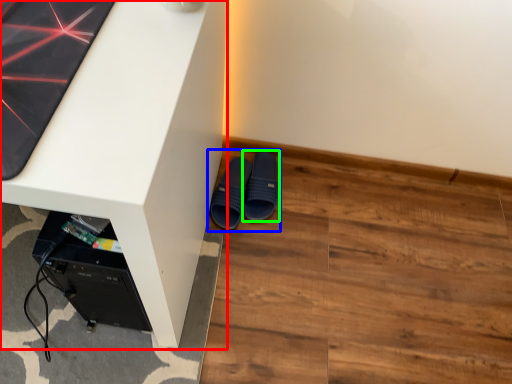
Question: Considering the real-world distances, which object is closest to desk (highlighted by a red box)? footwear (highlighted by a blue box) or footwear (highlighted by a green box).

Choices:
 (A) footwear
 (B) footwear

Answer: (A)